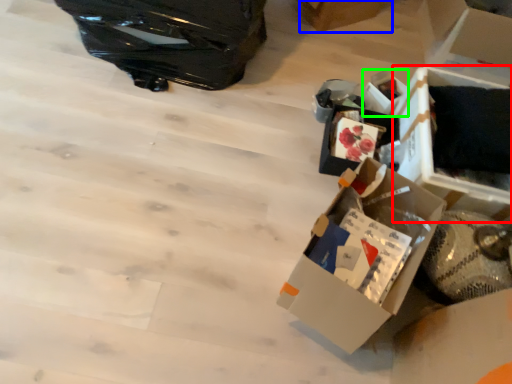
Question: Which is nearer to the storage box (highlighted by a red box)? cardboard box (highlighted by a blue box) or storage box (highlighted by a green box).

Choices:
 (A) cardboard box
 (B) storage box

Answer: (B)